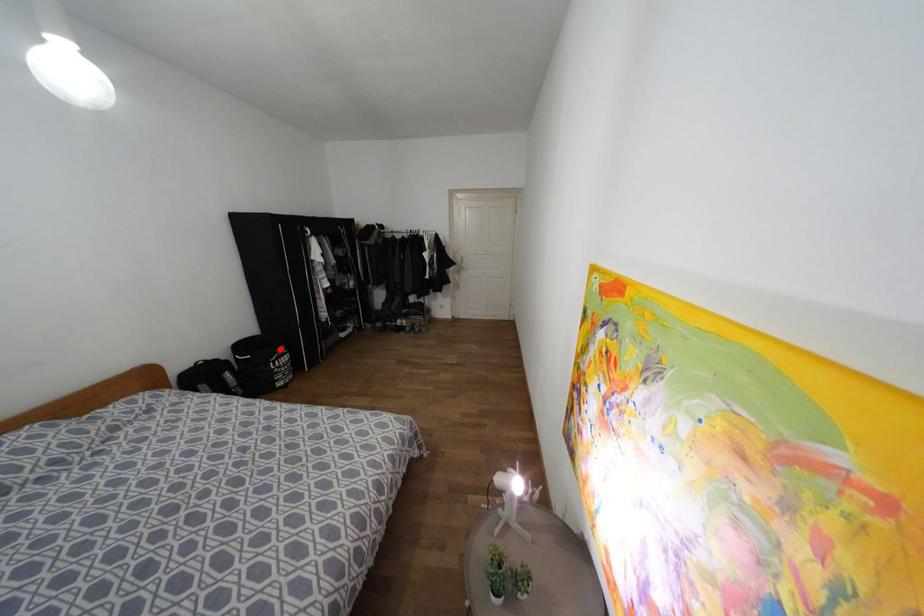
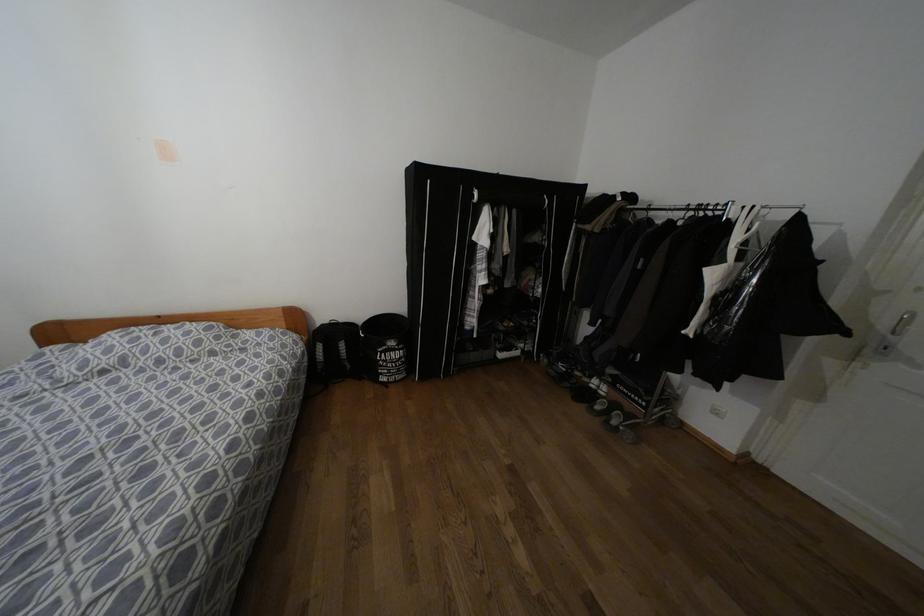
Question: I am providing you with two images of the same scene from different viewpoints. In image1, a red point is highlighted. Considering the same 3D point in image2, which of the following is correct?

Choices:
 (A) It is closer
 (B) It is farther

Answer: (B)